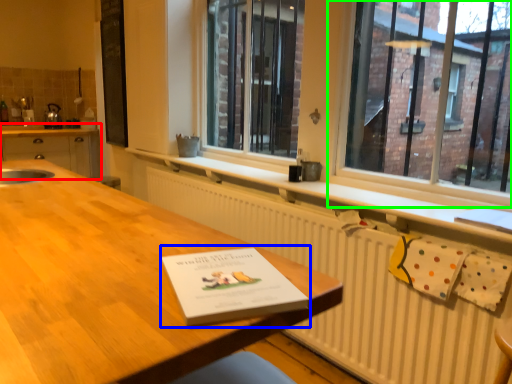
Question: Estimate the real-world distances between objects in this image. Which object is farther from cabinetry (highlighted by a red box), paperback book (highlighted by a blue box) or window (highlighted by a green box)?

Choices:
 (A) paperback book
 (B) window

Answer: (A)